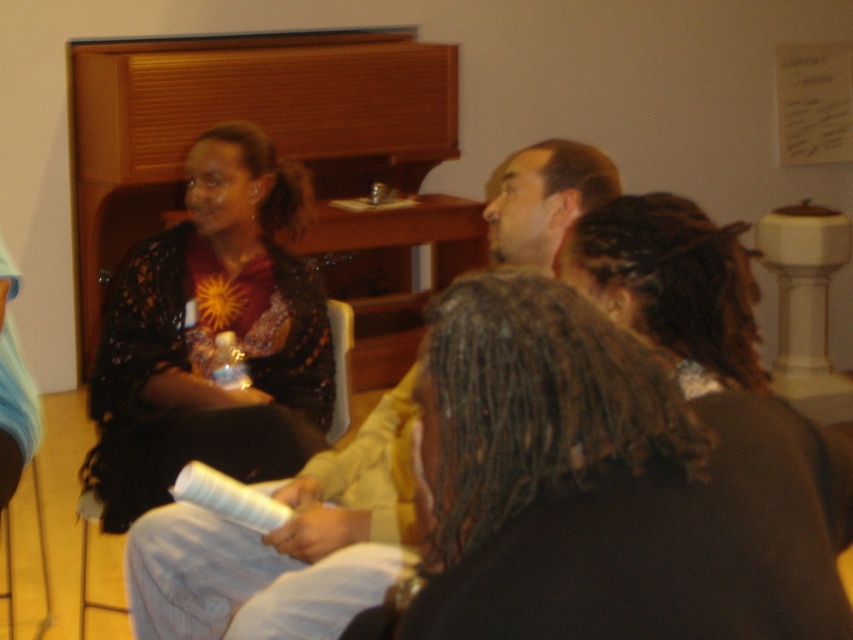
You are standing at the point labeled as point (x=212, y=538) and want to move to the exit located behind point labeled as point (x=224, y=422). Can you walk directly towards the exit without needing to go around any obstacles?

Point (x=224, y=422) is behind point (x=212, y=538), so you can walk directly towards the exit without needing to go around any obstacles.

You are standing at the entrance of the room and want to see the matte black shirt at upper center. Is the dark brown dreadlocks at center blocking your view of it?

The dark brown dreadlocks at center is in front of the matte black shirt at upper center, so yes, it is blocking your view of the matte black shirt at upper center.

You are part of a team discussion and need to pass a document to the person wearing the matte black dress at left without disturbing the person in the matte black shirt at upper center. How can you do this?

Since the matte black dress at left is positioned on the left side of the matte black shirt at upper center, you can pass the document to the matte black dress at left by moving around the left side of the matte black shirt at upper center to avoid disturbing them.